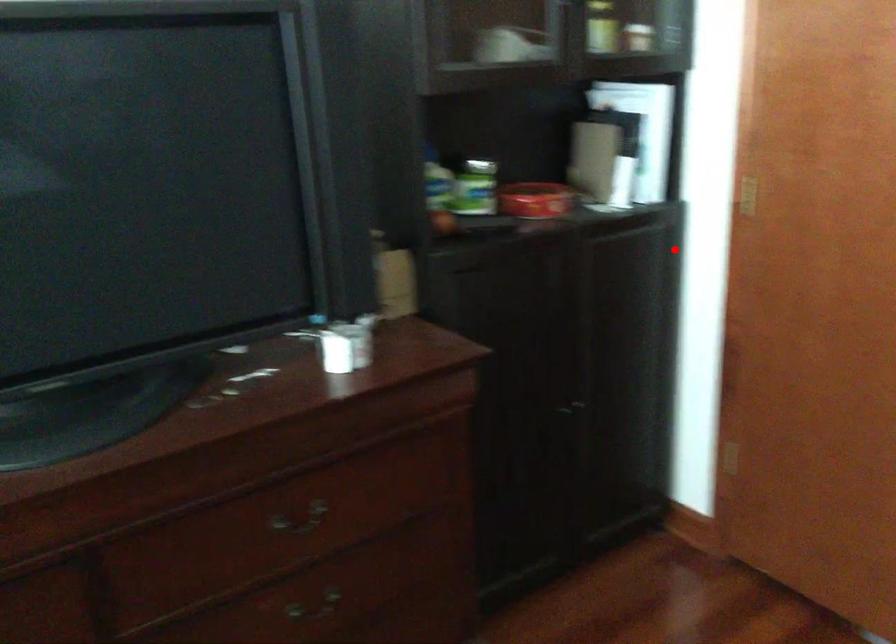
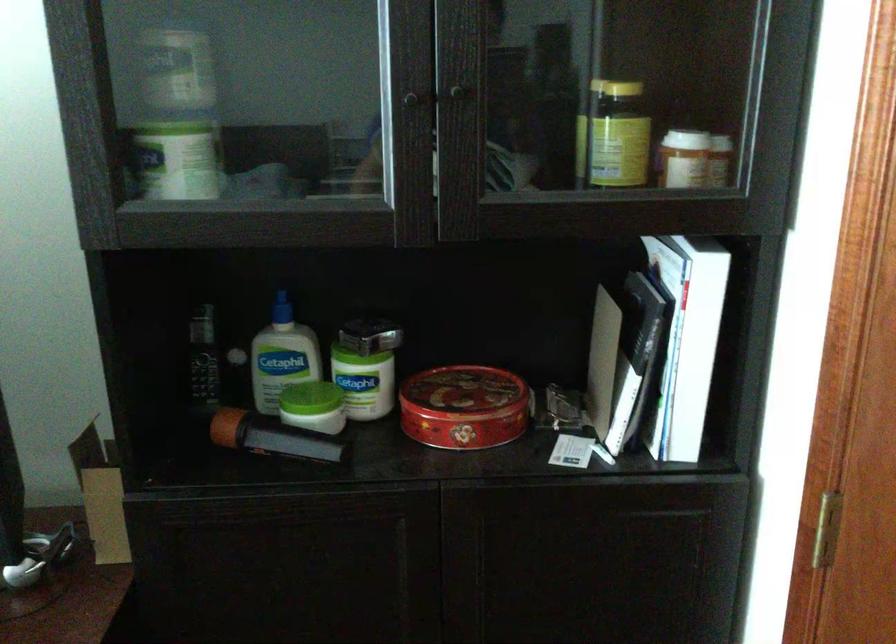
Where in the second image is the point corresponding to the highlighted location from the first image?

(707, 554)